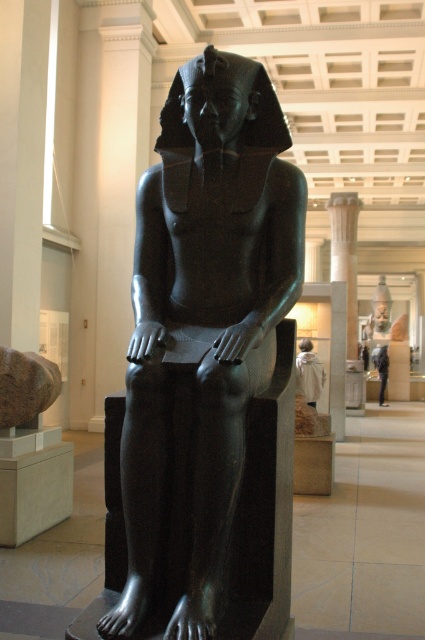
You are an art conservator examining the polished black statue at center and the white cotton shirt at center. Which object requires more space to move around it without touching anything?

The polished black statue at center requires more space to move around it without touching anything because it is larger in size than the white cotton shirt at center.

You are an art conservator examining the polished black statue at center and the light blue fabric at center in the museum. Which object is positioned closer to the entrance of the gallery?

The polished black statue at center is closer to the entrance of the gallery than the light blue fabric at center because it is closer to the viewer, implying it is placed nearer to the entrance where visitors first enter.